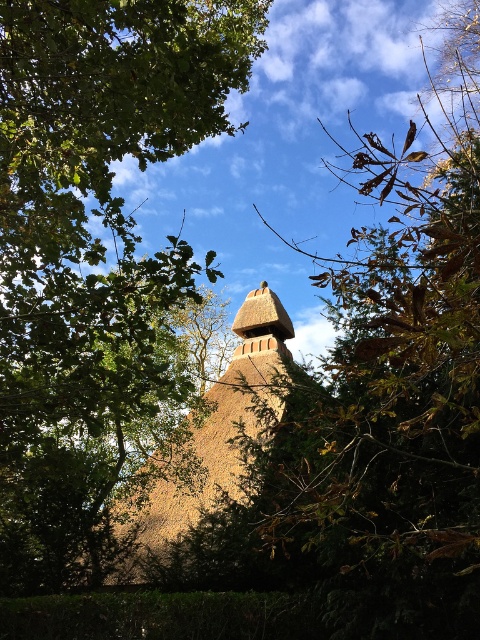
Question: Which point appears closest to the camera in this image?

Choices:
 (A) (264, 301)
 (B) (468, 301)

Answer: (B)

Question: Is brown textured chimney at center bigger than brown thatched hut at center?

Choices:
 (A) no
 (B) yes

Answer: (B)

Question: Which object appears closest to the camera in this image?

Choices:
 (A) brown thatched hut at center
 (B) brown textured chimney at center

Answer: (B)

Question: Which object is the farthest from the brown textured chimney at center?

Choices:
 (A) green leafy tree at upper left
 (B) brown thatched hut at center

Answer: (A)

Question: Is brown textured chimney at center closer to camera compared to brown thatched hut at center?

Choices:
 (A) yes
 (B) no

Answer: (A)

Question: Is green leafy tree at upper left in front of brown textured chimney at center?

Choices:
 (A) yes
 (B) no

Answer: (B)